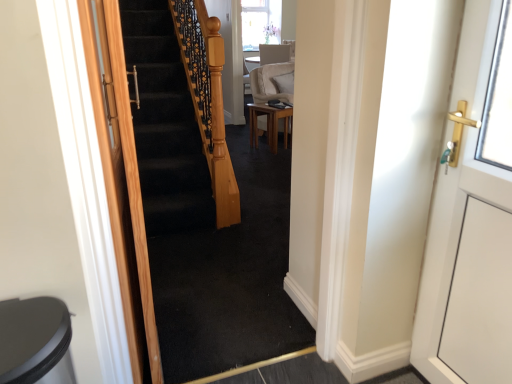
Image resolution: width=512 pixels, height=384 pixels. I want to click on free space to the back side of black carpeted stairs at center, so click(239, 326).